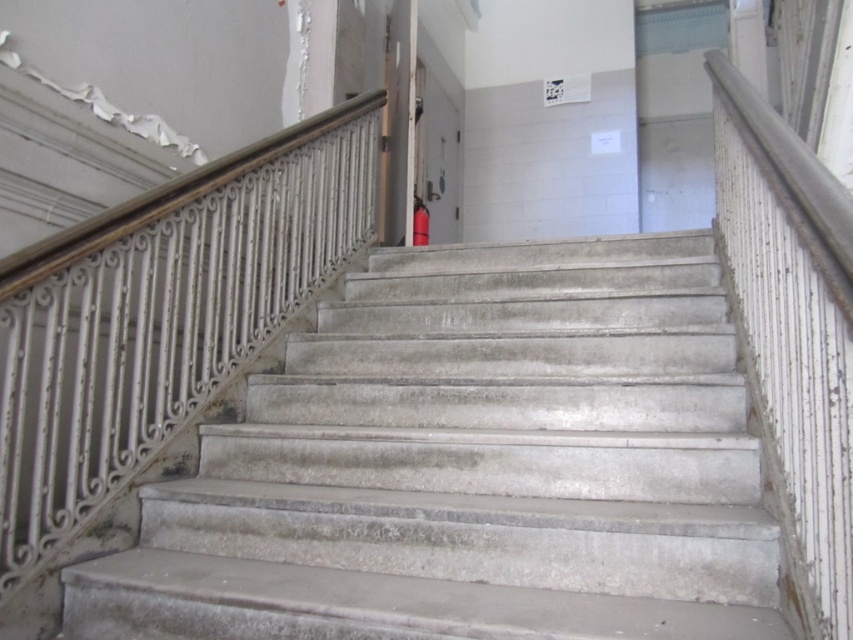
You are a maintenance worker assessing the staircase. You notice the concrete stairs at center and the white wrought iron at upper left. Which object is positioned higher in the image?

The white wrought iron at upper left is positioned higher than the concrete stairs at center in the image.

You are a painter assessing the condition of the staircase area. You notice the concrete stairs at center and the white wrought iron at upper left. Which object is closer to you as you stand at the base of the staircase?

The concrete stairs at center is in front of the white wrought iron at upper left, so the concrete stairs at center is closer to you.